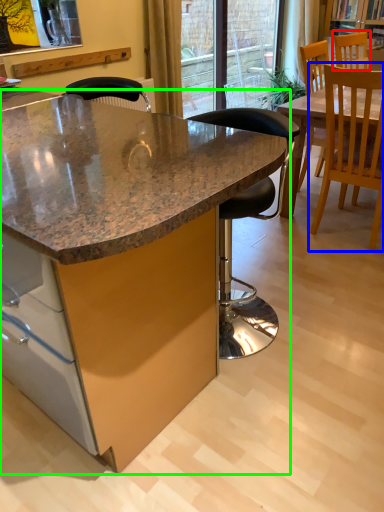
Question: Based on their relative distances, which object is nearer to chair (highlighted by a red box)? Choose from chair (highlighted by a blue box) and table (highlighted by a green box).

Choices:
 (A) chair
 (B) table

Answer: (A)